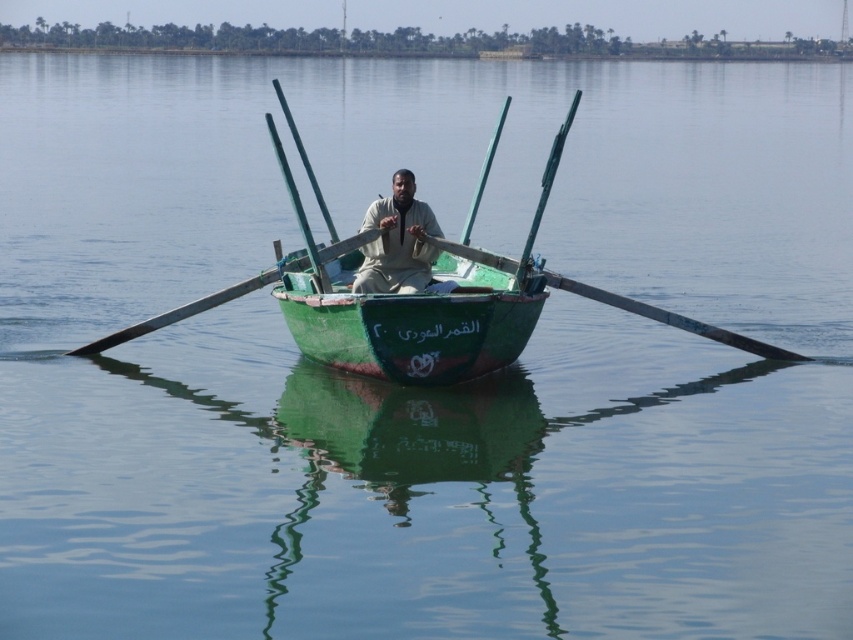
How much distance is there between green matte boat at center and green wooden paddle at center?

green matte boat at center is 2.34 meters away from green wooden paddle at center.

Does point (480, 323) come farther from viewer compared to point (213, 304)?

No, (480, 323) is closer to viewer.

Find the location of a particular element. This screenshot has height=640, width=853. green matte boat at center is located at coordinates (426, 305).

Does green matte canoe at center have a lesser height compared to light brown fabric shirt at center?

Correct, green matte canoe at center is not as tall as light brown fabric shirt at center.

Is green matte canoe at center to the left of light brown fabric shirt at center from the viewer's perspective?

In fact, green matte canoe at center is to the right of light brown fabric shirt at center.

Where is `green matte canoe at center`? The height and width of the screenshot is (640, 853). green matte canoe at center is located at coordinates (415, 323).

Is green matte boat at center thinner than light brown fabric shirt at center?

Correct, green matte boat at center's width is less than light brown fabric shirt at center's.

What do you see at coordinates (426, 305) in the screenshot?
I see `green matte boat at center` at bounding box center [426, 305].

Where is `green matte boat at center`? The height and width of the screenshot is (640, 853). green matte boat at center is located at coordinates (426, 305).